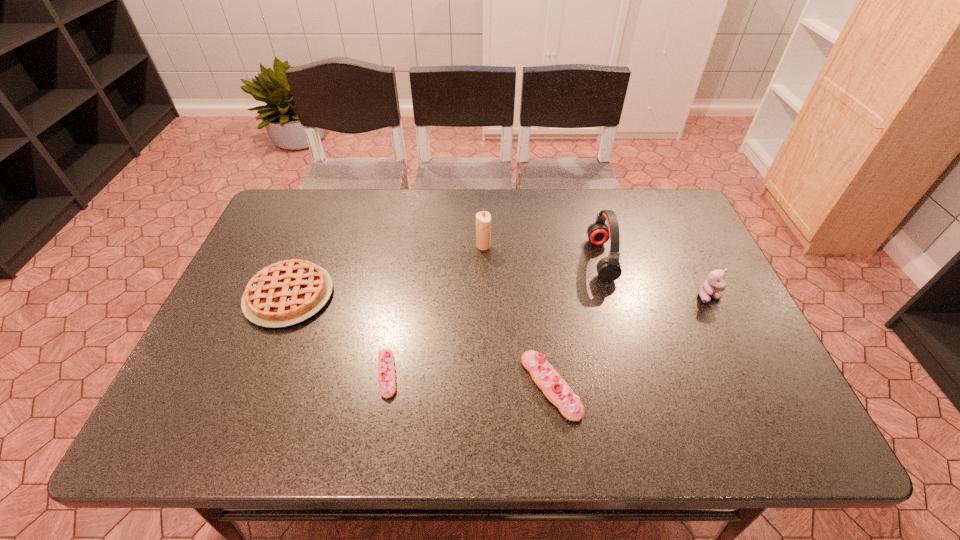
Where is `the left eclair`? the left eclair is located at coordinates (386, 367).

Locate an element on the screen. This screenshot has height=540, width=960. the shorter eclair is located at coordinates (x=386, y=367).

What are the coordinates of `the right eclair` in the screenshot? It's located at (554, 387).

Where is `the taller eclair`? This screenshot has width=960, height=540. the taller eclair is located at coordinates (554, 387).

Identify the location of the third object from left to right. (483, 219).

The height and width of the screenshot is (540, 960). What are the coordinates of `the leftmost object` in the screenshot? It's located at click(x=288, y=292).

The width and height of the screenshot is (960, 540). I want to click on the rightmost object, so click(x=714, y=285).

This screenshot has width=960, height=540. Identify the location of teddy bear. (714, 285).

The width and height of the screenshot is (960, 540). I want to click on earphone, so click(608, 268).

This screenshot has height=540, width=960. What are the coordinates of `vacant region located 0.340m on the back of the shortest object` in the screenshot? It's located at (408, 252).